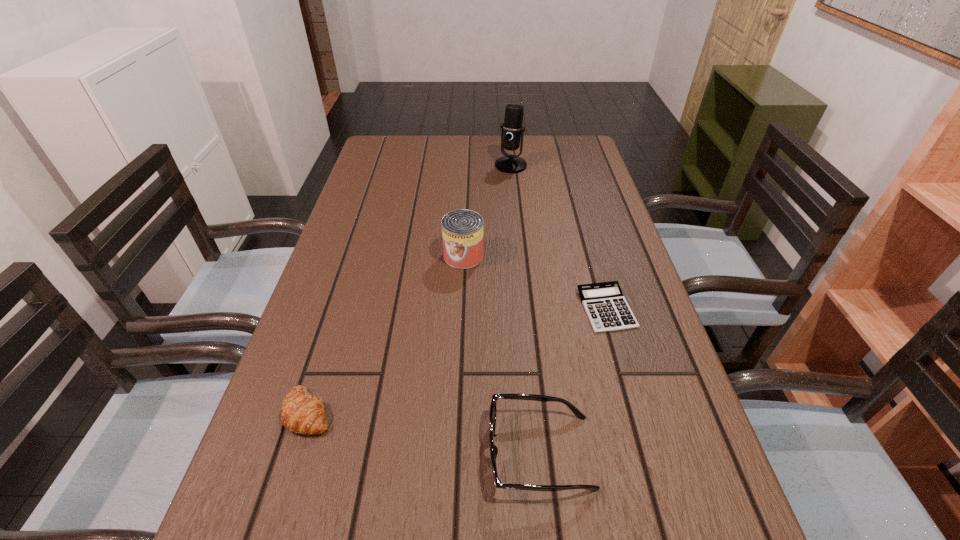
In the image, there is a desktop. Find the location of `blank space at the left edge`. blank space at the left edge is located at coordinates (370, 198).

At what (x,y) coordinates should I click in order to perform the action: click on free location at the right edge of the desktop. Please return your answer as a coordinate pair (x, y). The image size is (960, 540). Looking at the image, I should click on (655, 396).

Locate an element on the screen. blank space at the far left corner of the desktop is located at coordinates (373, 166).

The height and width of the screenshot is (540, 960). I want to click on vacant region between the tallest object and the rightmost object, so click(559, 237).

Locate an element on the screen. The image size is (960, 540). vacant space that is in between the third farthest object and the second farthest object is located at coordinates (535, 282).

Identify the location of vacant area that lies between the shortest object and the microphone. (559, 237).

The width and height of the screenshot is (960, 540). Identify the location of free area in between the microphone and the fourth shortest object. (487, 211).

Find the location of a particular element. This screenshot has width=960, height=540. free spot between the fourth shortest object and the spectacles is located at coordinates (502, 354).

Find the location of a particular element. free area in between the fourth shortest object and the shortest object is located at coordinates (535, 282).

Find the location of a particular element. This screenshot has width=960, height=540. vacant space in between the third shortest object and the fourth shortest object is located at coordinates (502, 354).